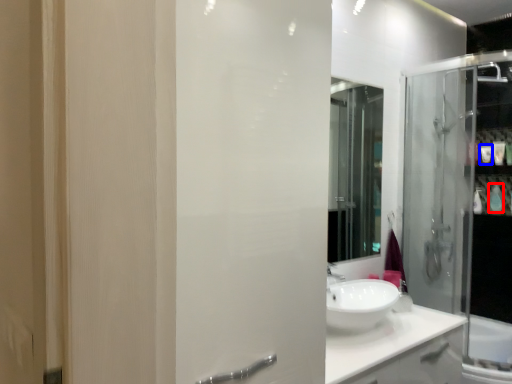
Question: Which of the following is the farthest to the observer, toiletry (highlighted by a red box) or toiletry (highlighted by a blue box)?

Choices:
 (A) toiletry
 (B) toiletry

Answer: (B)